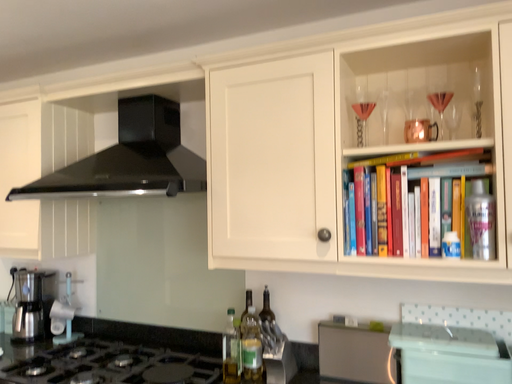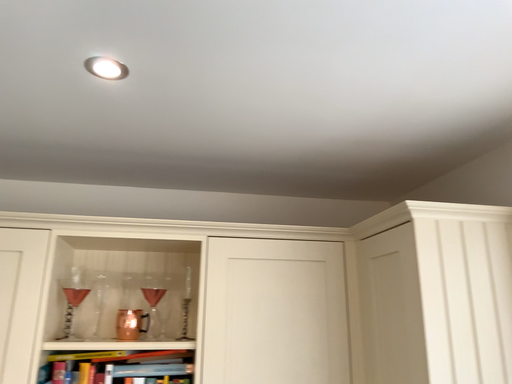
Question: Which way did the camera rotate in the video?

Choices:
 (A) rotated right
 (B) rotated left

Answer: (A)